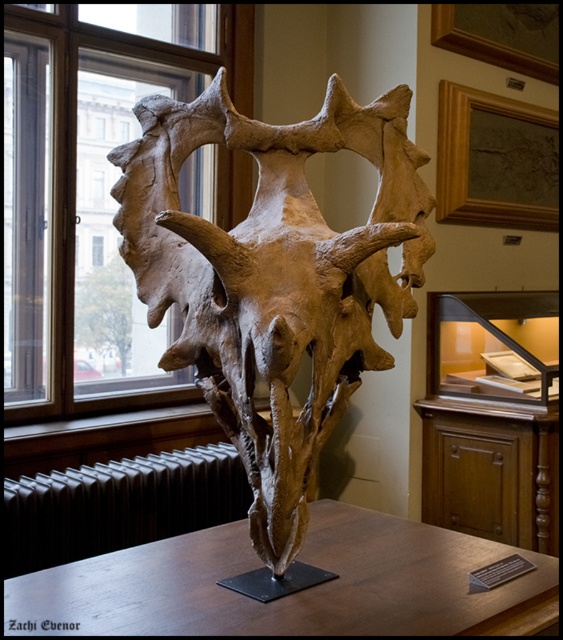
You are a museum visitor who is 1.7 meters tall. You are standing in front of the brown bone skull at center. Can you comfortably view the entire skull without bending down or tilting your head back too much?

The brown bone skull at center is 2.01 meters away from you. Since you are 1.7 meters tall, the distance allows you to comfortably view the entire skull without needing to bend down or tilt your head excessively.

You are a visitor in the museum and want to take a photo of the dinosaur skull. You notice the clear glass window at upper left and the black metal radiator at lower left. Which object is taller and might cause a reflection issue if you take the photo from that angle?

The clear glass window at upper left is taller than the black metal radiator at lower left. Therefore, the clear glass window at upper left might cause a reflection issue if you take the photo from that angle due to its height and reflective surface.

You are a visitor standing in the museum and want to take a photo of the dinosaur skull on the brown wooden table at center. To avoid reflections from the black metal radiator at lower left, where should you position yourself relative to the radiator?

The brown wooden table at center is located above the black metal radiator at lower left, so positioning yourself to the side or behind the radiator would help avoid reflections from it.